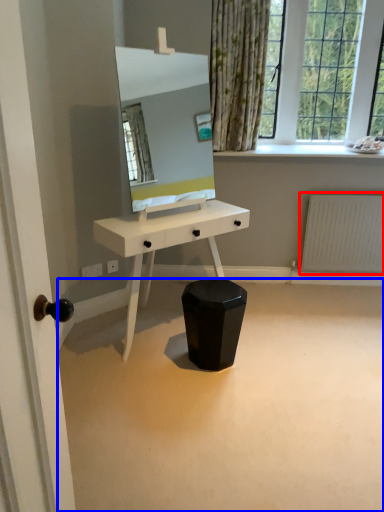
Question: Which of the following is the closest to the observer, radiator (highlighted by a red box) or plain (highlighted by a blue box)?

Choices:
 (A) radiator
 (B) plain

Answer: (B)